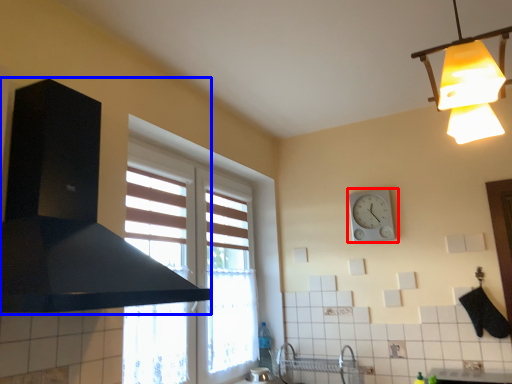
Question: Which of the following is the farthest to the observer, wall clock (highlighted by a red box) or exhaust hood (highlighted by a blue box)?

Choices:
 (A) wall clock
 (B) exhaust hood

Answer: (A)